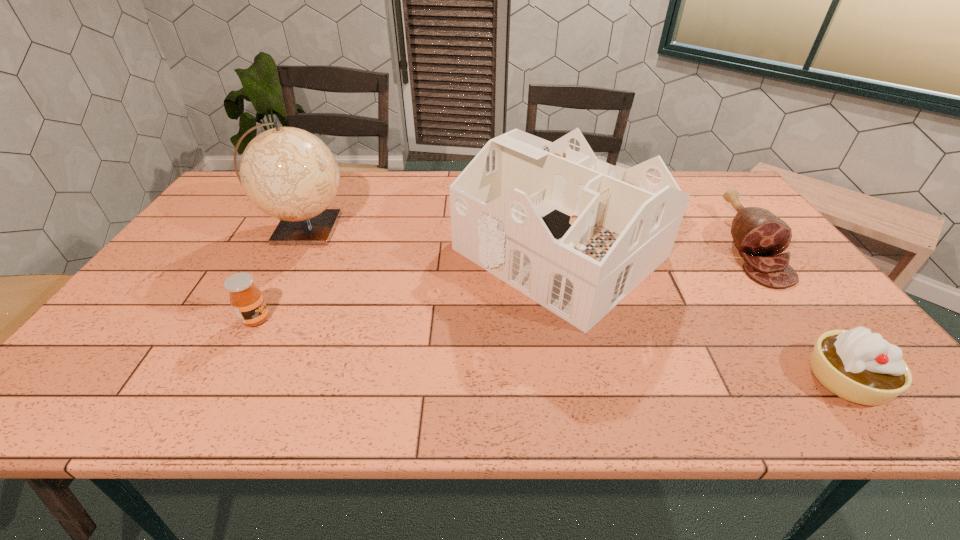
Find the location of `globe`. globe is located at coordinates (288, 173).

I want to click on the second tallest object, so pos(575,234).

Identify the location of dollhouse. (575, 234).

I want to click on honey, so click(246, 299).

The height and width of the screenshot is (540, 960). I want to click on ham, so click(759, 235).

The width and height of the screenshot is (960, 540). I want to click on the nearest object, so click(858, 366).

Identify the location of free region located on the surface of the globe showing Europe and Africa. (450, 229).

The width and height of the screenshot is (960, 540). Identify the location of vacant space situated on the right of the dollhouse. (757, 253).

Find the location of `vacant region located on the front-facing side of the honey`. vacant region located on the front-facing side of the honey is located at coordinates (406, 319).

Locate an element on the screen. The image size is (960, 540). free space located 0.080m at the sliced end of the ham is located at coordinates tap(798, 311).